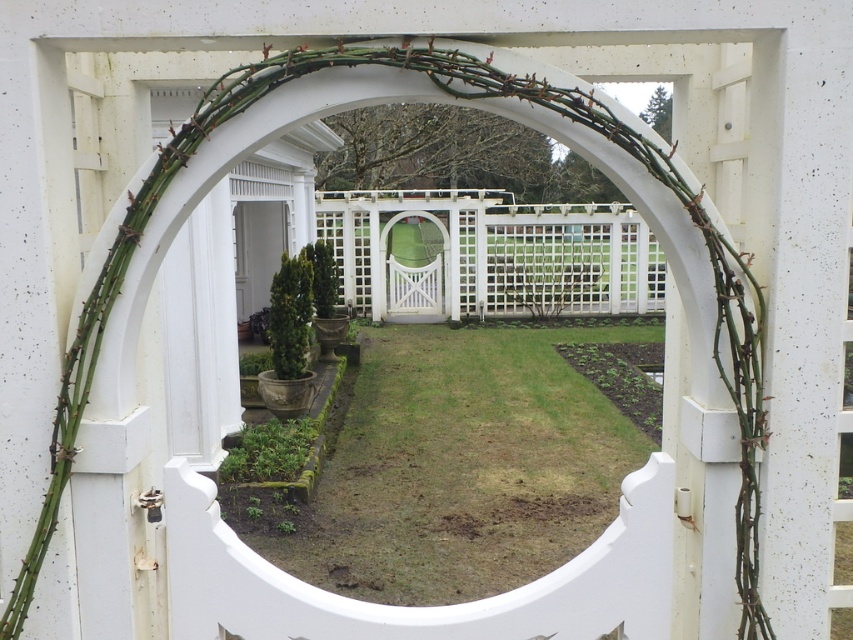
You are standing in front of the garden scene with a white arched doorway. You need to move a 1.2 meter wide garden bench through the space between the white lattice fence at center and the white glossy door at center. Can the bench fit through the space between them?

The white lattice fence at center might be wider than the white glossy door at center, so the space between them may be too narrow for the 1.2 meter wide bench to fit through. It is uncertain without exact measurements.